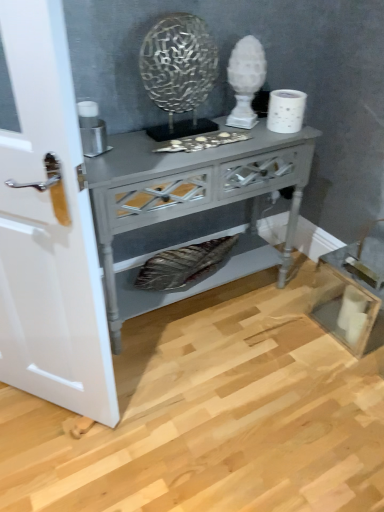
Question: Is point (81, 132) positioned closer to the camera than point (114, 417)?

Choices:
 (A) farther
 (B) closer

Answer: (B)

Question: Relative to white glossy door at left, is metallic silver candle holder at left in front or behind?

Choices:
 (A) behind
 (B) front

Answer: (A)

Question: Which of these objects is positioned closest to the white textured toilet paper at upper right?

Choices:
 (A) metallic silver candle holder at left
 (B) white glossy door at left
 (C) matte gray wooden nightstand at center

Answer: (C)

Question: Which object is positioned farthest from the matte gray wooden nightstand at center?

Choices:
 (A) white textured toilet paper at upper right
 (B) white glossy door at left
 (C) metallic silver candle holder at left

Answer: (B)